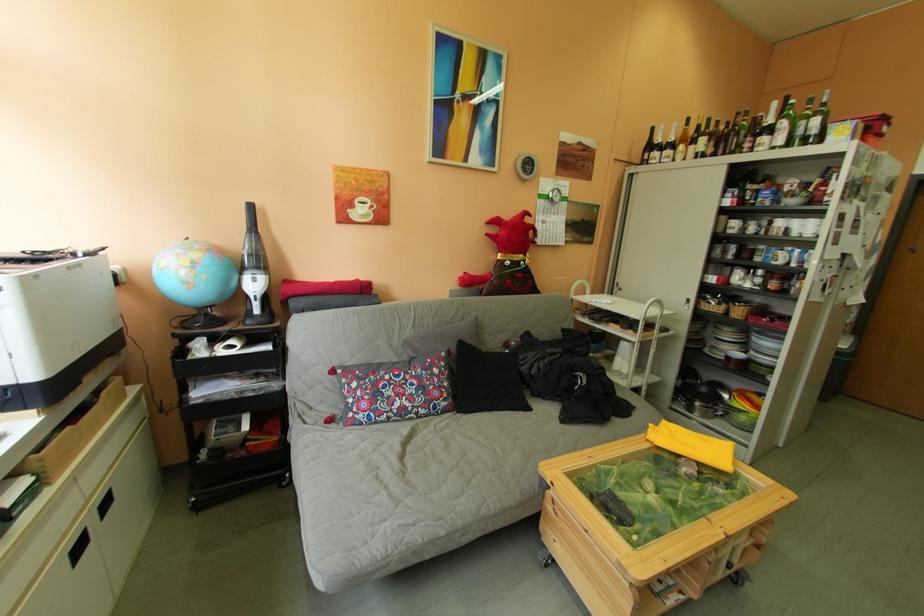
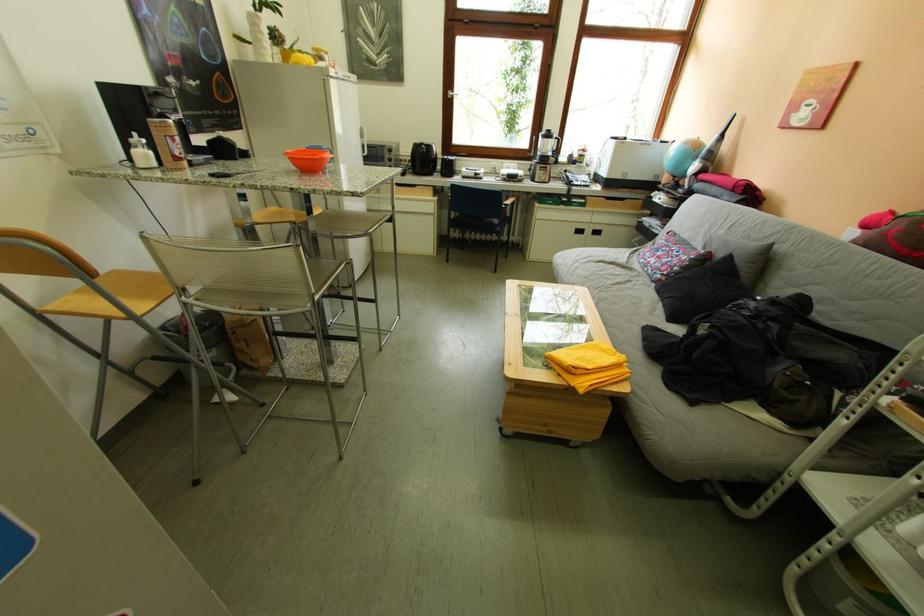
Locate, in the second image, the point that corresponds to (455,367) in the first image.

(706, 259)